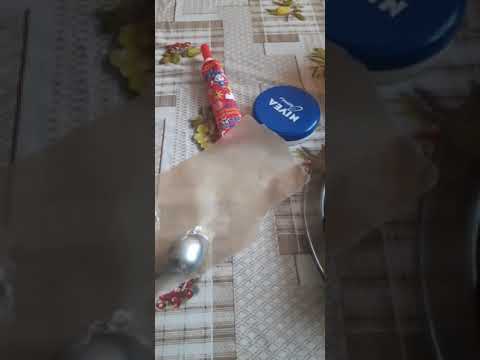
Where is `clear plate`? The height and width of the screenshot is (360, 480). clear plate is located at coordinates (314, 250).